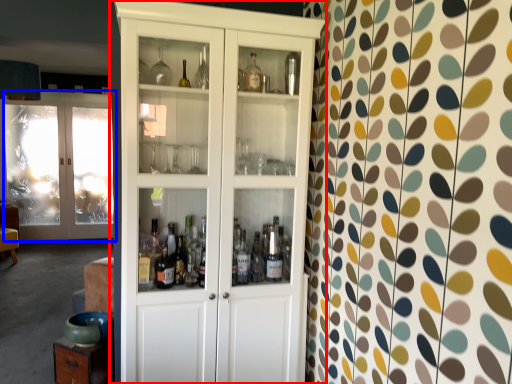
Question: Among these objects, which one is farthest to the camera, cupboard (highlighted by a red box) or door (highlighted by a blue box)?

Choices:
 (A) cupboard
 (B) door

Answer: (B)